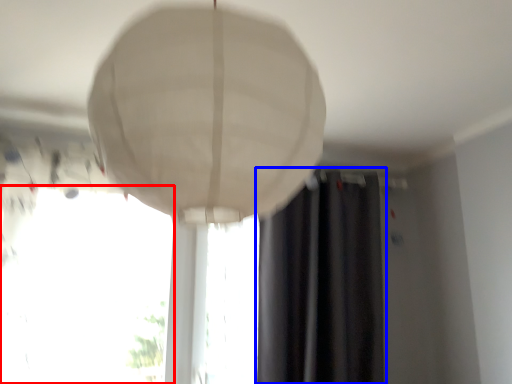
Question: Which point is further to the camera, window (highlighted by a red box) or curtain (highlighted by a blue box)?

Choices:
 (A) window
 (B) curtain

Answer: (B)